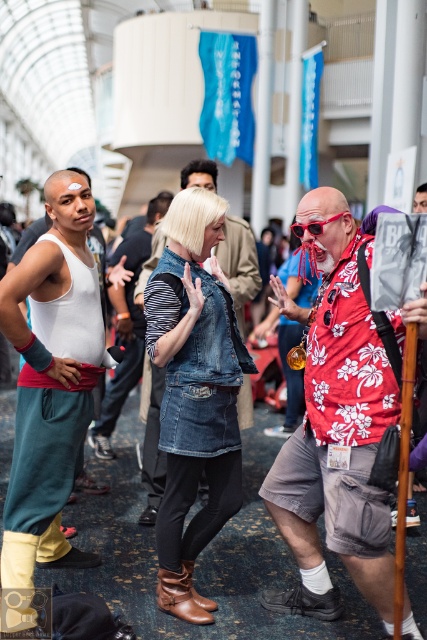
Is floral print shirt at center taller than white cotton tank top at center?

No, floral print shirt at center is not taller than white cotton tank top at center.

What do you see at coordinates (335, 429) in the screenshot?
I see `floral print shirt at center` at bounding box center [335, 429].

The height and width of the screenshot is (640, 427). Identify the location of floral print shirt at center. (335, 429).

Between floral print shirt at center and white matte tank top at left, which one appears on the right side from the viewer's perspective?

floral print shirt at center is more to the right.

Is floral print shirt at center below white matte tank top at left?

Yes, floral print shirt at center is below white matte tank top at left.

What do you see at coordinates (335, 429) in the screenshot? This screenshot has height=640, width=427. I see `floral print shirt at center` at bounding box center [335, 429].

At what (x,y) coordinates should I click in order to perform the action: click on floral print shirt at center. Please return your answer as a coordinate pair (x, y). Image resolution: width=427 pixels, height=640 pixels. Looking at the image, I should click on (335, 429).

Can you confirm if white matte tank top at left is positioned below white cotton tank top at center?

Yes.

Does white matte tank top at left have a larger size compared to white cotton tank top at center?

Incorrect, white matte tank top at left is not larger than white cotton tank top at center.

Who is more forward, (20, 321) or (131, 284)?

Point (20, 321) is in front.

Where is `white matte tank top at left`? white matte tank top at left is located at coordinates (50, 380).